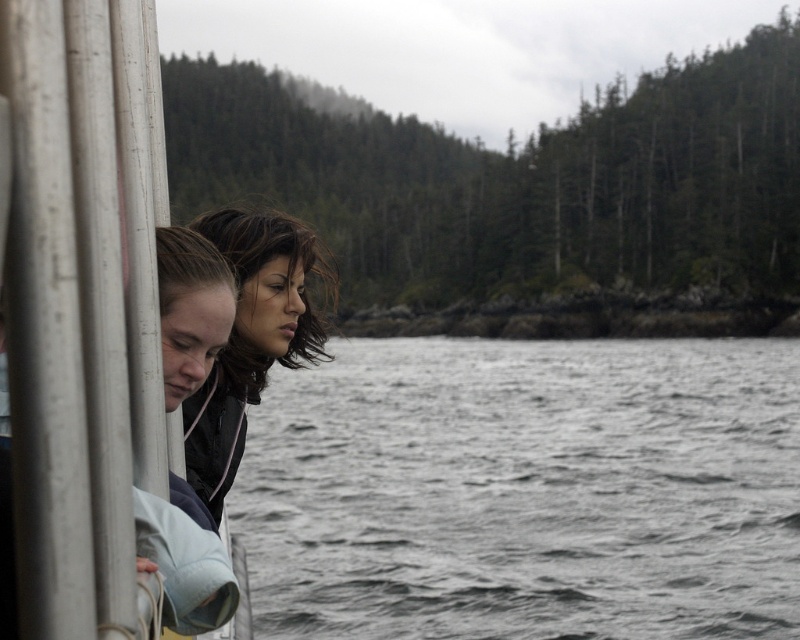
You are navigating a small boat and need to avoid hitting a rock. The coordinates of the rock are at point (526, 490). According to the image, what is located at those coordinates?

At point (526, 490) lies gray water at center, so the coordinates point to gray water at center which is safe for navigation.

You are navigating a metallic silver boat at left and need to reach a destination located at the gray water at center. According to the scene, which direction should you steer the boat to reach the destination?

The gray water at center is to the right of the metallic silver boat at left, so you should steer the boat to the right to reach the destination.

You are planning to place a decorative item on the metallic silver boat at left. The item requires a surface area equal to the width of the matte black jacket at center. Will the boat be wide enough?

The metallic silver boat at left is narrower than the matte black jacket at center, so it may not provide enough surface area for the item requiring the jacket width. Consider a wider surface.